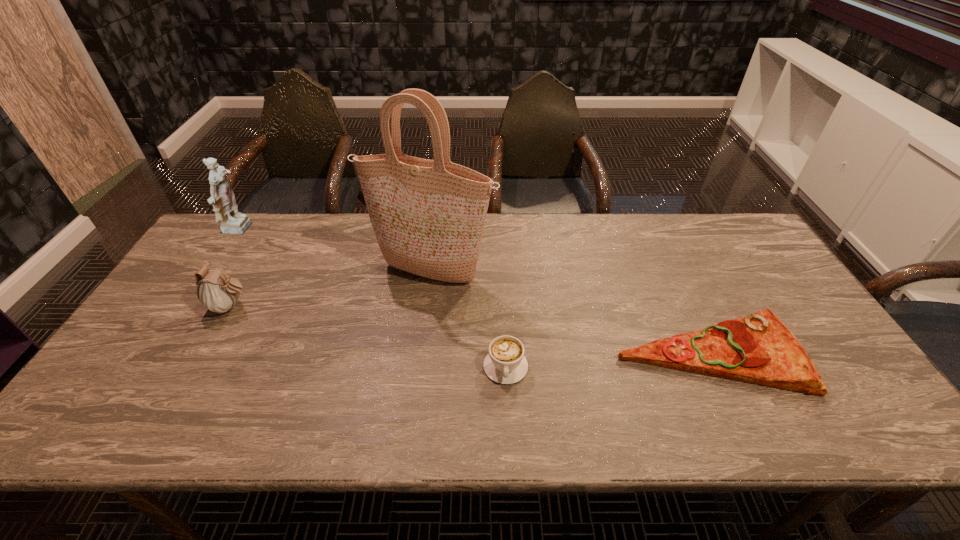
Locate an element on the screen. This screenshot has width=960, height=540. free spot between the cappuccino and the shopping bag is located at coordinates (468, 320).

Where is `free space between the shortest object and the fourth nearest object`? free space between the shortest object and the fourth nearest object is located at coordinates click(x=569, y=313).

Image resolution: width=960 pixels, height=540 pixels. Identify the location of free space between the figurine and the shortest object. (473, 292).

Identify the location of free space between the second tallest object and the shopping bag. This screenshot has height=540, width=960. (335, 252).

This screenshot has height=540, width=960. Identify the location of vacant area between the tallest object and the shortest object. (569, 313).

The height and width of the screenshot is (540, 960). What are the coordinates of `vacant area that lies between the shopping bag and the leftmost object` in the screenshot? It's located at (335, 252).

You are a GUI agent. You are given a task and a screenshot of the screen. Output one action in this format:
    pyautogui.click(x=<x>, y=<y>)
    Task: Click on the empty space between the tallest object and the pizza
    This screenshot has height=540, width=960.
    Given the screenshot: What is the action you would take?
    pyautogui.click(x=569, y=313)

Select which object is the second closest to the cappuccino. Please provide its 2D coordinates. Your answer should be formatted as a tuple, i.e. [(x, y)], where the tuple contains the x and y coordinates of a point satisfying the conditions above.

[(759, 349)]

Choose which object is the nearest neighbor to the fourth object from right to left. Please provide its 2D coordinates. Your answer should be formatted as a tuple, i.e. [(x, y)], where the tuple contains the x and y coordinates of a point satisfying the conditions above.

[(222, 198)]

You are a GUI agent. You are given a task and a screenshot of the screen. Output one action in this format:
    pyautogui.click(x=<x>, y=<y>)
    Task: Click on the free region that satisfies the following two spatial constraints: 1. on the front-facing side of the rightmost object; 2. on the right side of the figurine
    This screenshot has width=960, height=540.
    Given the screenshot: What is the action you would take?
    pyautogui.click(x=158, y=353)